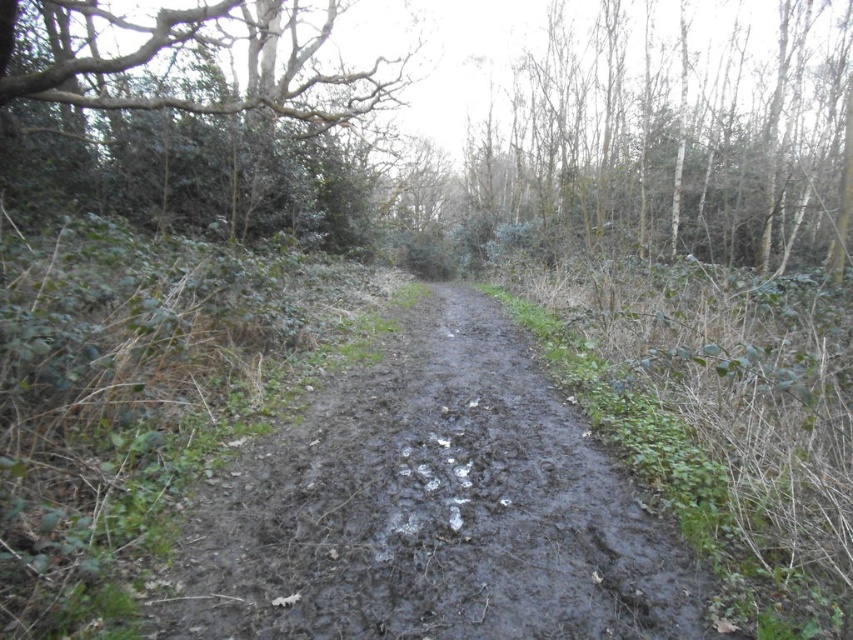
Question: Based on their relative distances, which object is farther from the muddy/damp dirt track at center?

Choices:
 (A) bare branches at upper right
 (B) green leafy tree at upper left

Answer: (A)

Question: Which point is closer to the camera taking this photo?

Choices:
 (A) (793, 12)
 (B) (415, 525)
 (C) (358, 228)

Answer: (B)

Question: Can you confirm if bare branches at upper right is bigger than green leafy tree at upper left?

Choices:
 (A) yes
 (B) no

Answer: (B)

Question: Considering the relative positions of muddy/damp dirt track at center and bare branches at upper right in the image provided, where is muddy/damp dirt track at center located with respect to bare branches at upper right?

Choices:
 (A) right
 (B) left

Answer: (B)

Question: From the image, what is the correct spatial relationship of muddy/damp dirt track at center in relation to green leafy tree at upper left?

Choices:
 (A) right
 (B) left

Answer: (A)

Question: Which is nearer to the muddy/damp dirt track at center?

Choices:
 (A) bare branches at upper right
 (B) green leafy tree at upper left

Answer: (B)